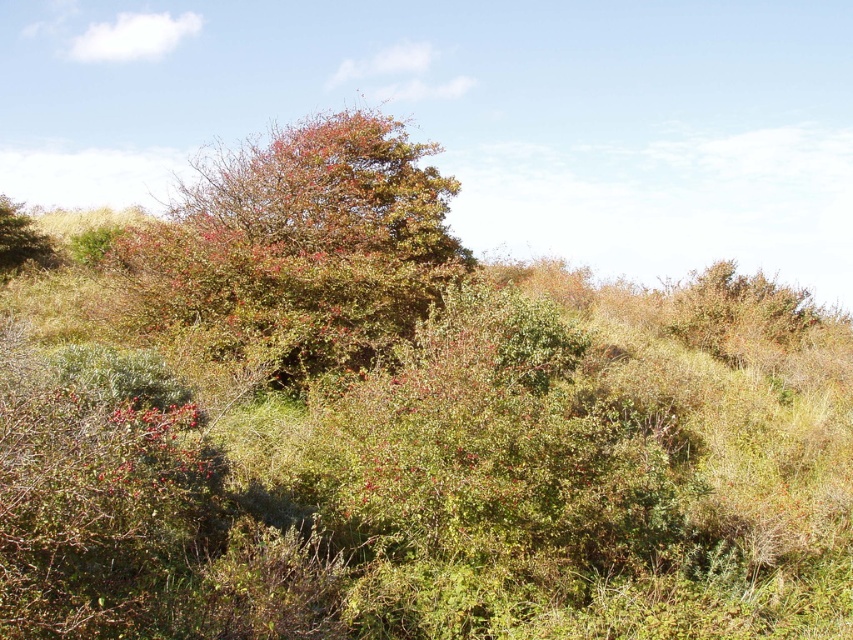
You are standing in a natural landscape with dense vegetation. You see two points marked in the scene. The first point is at coordinates point (368, 269) and the second is at point (49, 259). Which point is closer to you?

Point (368, 269) is closer to the viewer than point (49, 259).

You are standing in the natural landscape described. You need to locate the green leafy bush at center. According to the coordinates provided, where exactly is it positioned?

The green leafy bush at center is located at the 2D coordinates point (x=300, y=248).